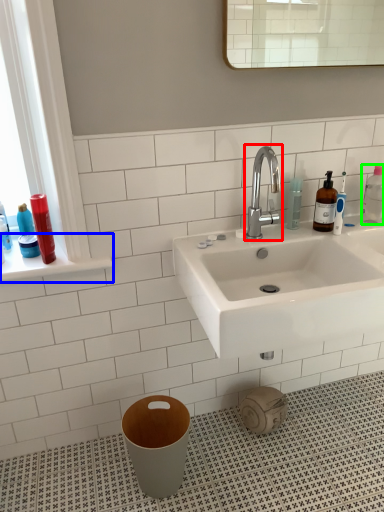
Question: Which is farther away from tap (highlighted by a red box)? window sill (highlighted by a blue box) or cleaning product (highlighted by a green box)?

Choices:
 (A) window sill
 (B) cleaning product

Answer: (A)